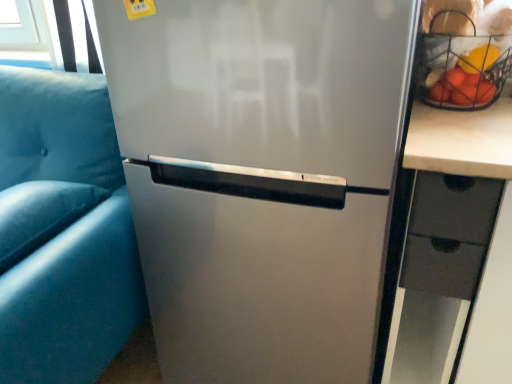
Question: Are metallic wire basket at upper right and suede-like blue pillow at left making contact?

Choices:
 (A) yes
 (B) no

Answer: (B)

Question: Is metallic wire basket at upper right outside of suede-like blue pillow at left?

Choices:
 (A) yes
 (B) no

Answer: (A)

Question: Considering the relative sizes of metallic wire basket at upper right and suede-like blue pillow at left in the image provided, is metallic wire basket at upper right bigger than suede-like blue pillow at left?

Choices:
 (A) yes
 (B) no

Answer: (A)

Question: Can you confirm if metallic wire basket at upper right is wider than suede-like blue pillow at left?

Choices:
 (A) yes
 (B) no

Answer: (B)

Question: From the image's perspective, is metallic wire basket at upper right below suede-like blue pillow at left?

Choices:
 (A) yes
 (B) no

Answer: (B)

Question: In the image, is matte blue armchair at left on the left side or the right side of metallic wire basket at upper right?

Choices:
 (A) left
 (B) right

Answer: (A)

Question: Considering the positions of point (71, 97) and point (497, 36), is point (71, 97) closer or farther from the camera than point (497, 36)?

Choices:
 (A) closer
 (B) farther

Answer: (B)

Question: From their relative heights in the image, would you say matte blue armchair at left is taller or shorter than metallic wire basket at upper right?

Choices:
 (A) tall
 (B) short

Answer: (A)

Question: In terms of size, does matte blue armchair at left appear bigger or smaller than metallic wire basket at upper right?

Choices:
 (A) big
 (B) small

Answer: (A)

Question: Considering the positions of metallic wire basket at upper right and suede-like blue pillow at left in the image, is metallic wire basket at upper right taller or shorter than suede-like blue pillow at left?

Choices:
 (A) short
 (B) tall

Answer: (B)

Question: In the image, is metallic wire basket at upper right positioned in front of or behind suede-like blue pillow at left?

Choices:
 (A) front
 (B) behind

Answer: (B)

Question: Is point pos(489,11) closer or farther from the camera than point pos(98,188)?

Choices:
 (A) farther
 (B) closer

Answer: (B)

Question: From a real-world perspective, is metallic wire basket at upper right physically located above or below suede-like blue pillow at left?

Choices:
 (A) above
 (B) below

Answer: (A)

Question: Is suede-like blue pillow at left inside the boundaries of matte black drawer at right, or outside?

Choices:
 (A) inside
 (B) outside

Answer: (B)

Question: Relative to matte black drawer at right, is suede-like blue pillow at left in front or behind?

Choices:
 (A) front
 (B) behind

Answer: (B)